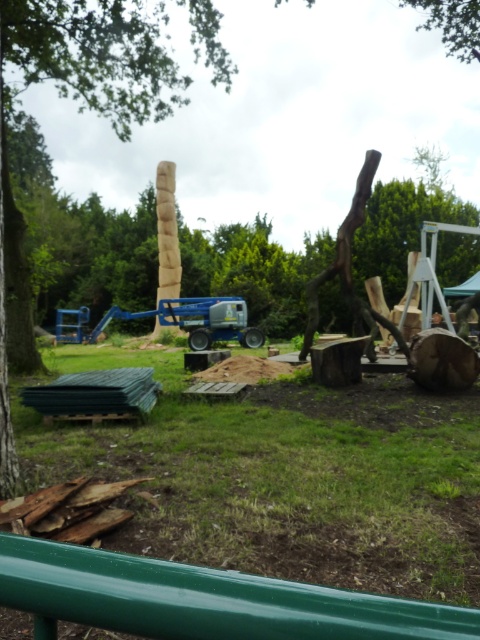
You are standing in the outdoor scene and want to walk towards the green grass at center. Which direction should you move relative to the brown rough tree trunk at left?

Since the green grass at center is closer to the viewer than the brown rough tree trunk at left, you should move towards the center of the image, away from the brown rough tree trunk at left to reach the green grass at center.

From the picture: You are a gardener who wants to plant a flower bed between the green grass at center and the brown rough tree trunk at left. Can you do that?

The green grass at center is positioned under the brown rough tree trunk at left, so planting a flower bed between them might not be possible since the tree trunk is above the grass.

You are standing in the outdoor scene and want to place a small wooden stool exactly at the center of the green grass at center. According to the coordinates provided, where should you place the stool?

The green grass at center is located at point (285,477), so you should place the stool at those coordinates to position it exactly at the center of the green grass at center.